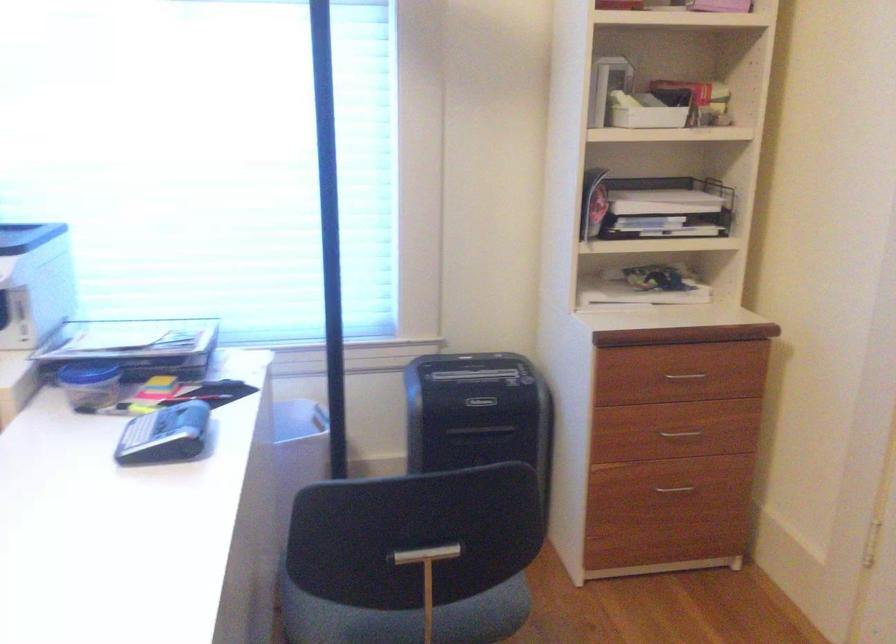
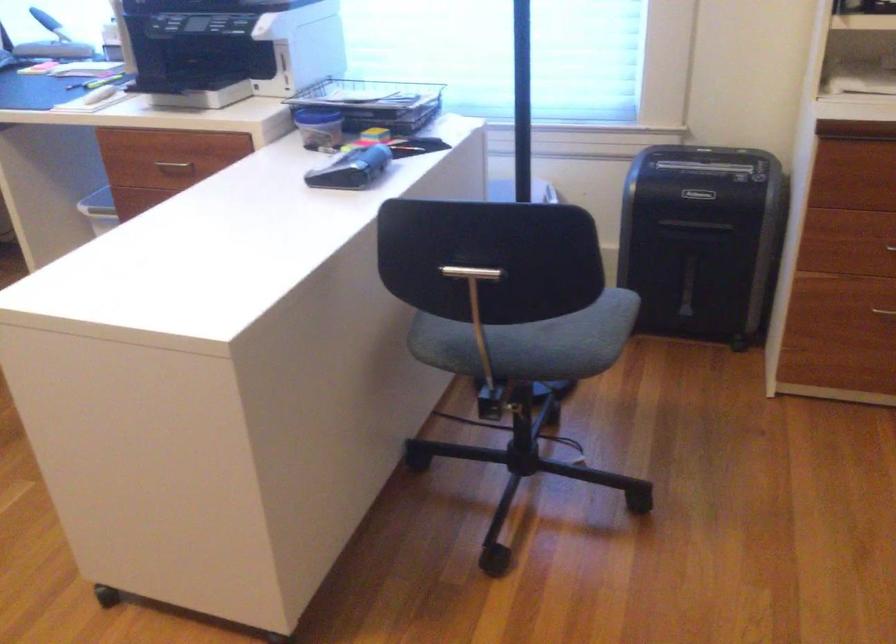
Find the pixel in the second image that matches (x=664, y=433) in the first image.

(890, 247)